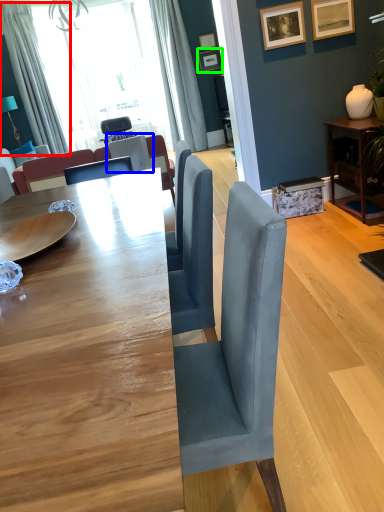
Question: Which object is positioned farthest from curtain (highlighted by a red box)? Select from chair (highlighted by a blue box) and picture frame (highlighted by a green box).

Choices:
 (A) chair
 (B) picture frame

Answer: (B)